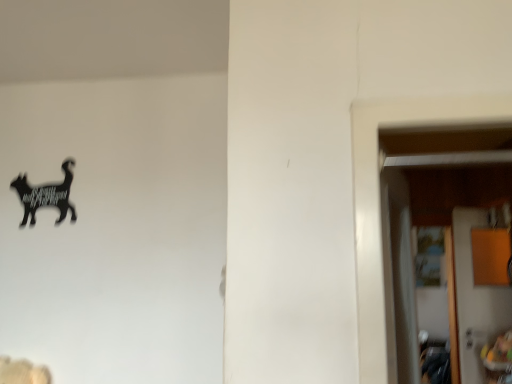
Question: Could you tell me if black matte cat at upper left is facing wooden door at right?

Choices:
 (A) no
 (B) yes

Answer: (A)

Question: Is wooden door at right inside black matte cat at upper left?

Choices:
 (A) no
 (B) yes

Answer: (A)

Question: Does black matte cat at upper left have a greater height compared to wooden door at right?

Choices:
 (A) yes
 (B) no

Answer: (B)

Question: From a real-world perspective, is black matte cat at upper left physically above wooden door at right?

Choices:
 (A) no
 (B) yes

Answer: (B)

Question: Is black matte cat at upper left to the left of wooden door at right from the viewer's perspective?

Choices:
 (A) yes
 (B) no

Answer: (A)

Question: Can you confirm if black matte cat at upper left is wider than wooden door at right?

Choices:
 (A) yes
 (B) no

Answer: (B)

Question: Is wooden door at right bigger than black matte cat at upper left?

Choices:
 (A) no
 (B) yes

Answer: (B)

Question: Is the depth of wooden door at right less than that of black matte cat at upper left?

Choices:
 (A) no
 (B) yes

Answer: (A)

Question: Does wooden door at right come behind black matte cat at upper left?

Choices:
 (A) yes
 (B) no

Answer: (A)

Question: Is wooden door at right located outside black matte cat at upper left?

Choices:
 (A) yes
 (B) no

Answer: (A)

Question: Can you confirm if wooden door at right is positioned to the right of black matte cat at upper left?

Choices:
 (A) no
 (B) yes

Answer: (B)

Question: Is wooden door at right beside black matte cat at upper left?

Choices:
 (A) yes
 (B) no

Answer: (B)

Question: Does point (15, 178) appear closer or farther from the camera than point (452, 215)?

Choices:
 (A) closer
 (B) farther

Answer: (A)